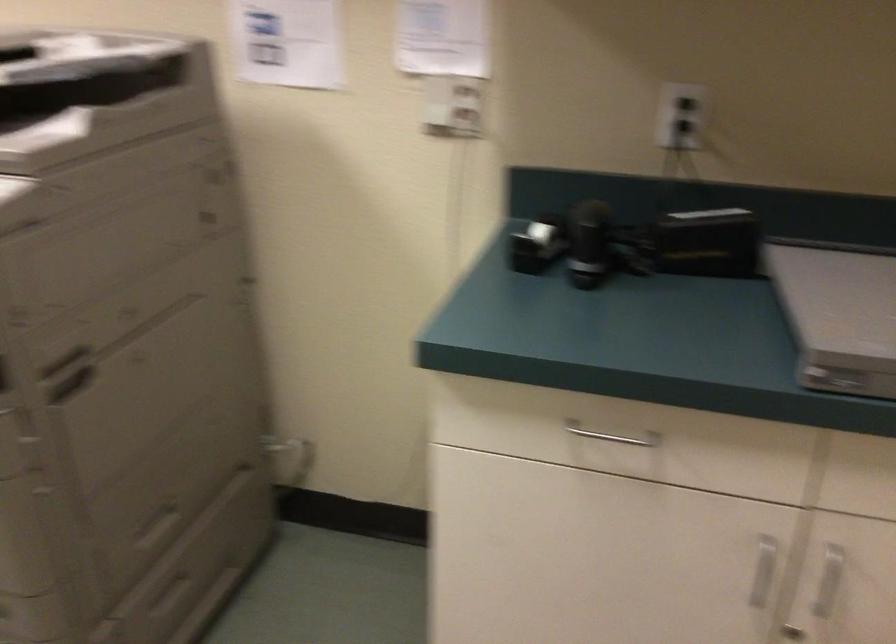
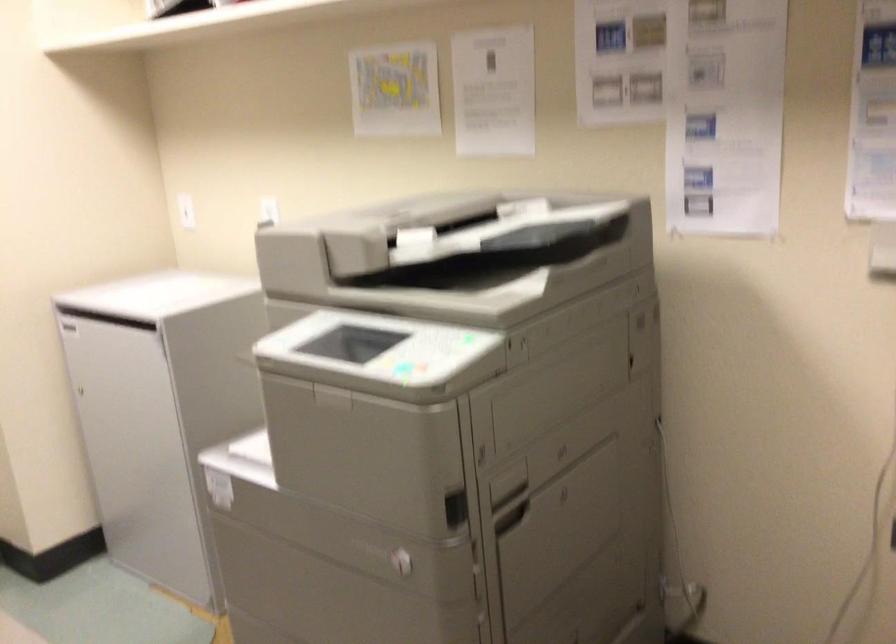
Question: The camera is either moving clockwise (left) or counter-clockwise (right) around the object. The first image is from the beginning of the video and the second image is from the end. Is the camera moving left or right when shooting the video?

Choices:
 (A) Left
 (B) Right

Answer: (B)